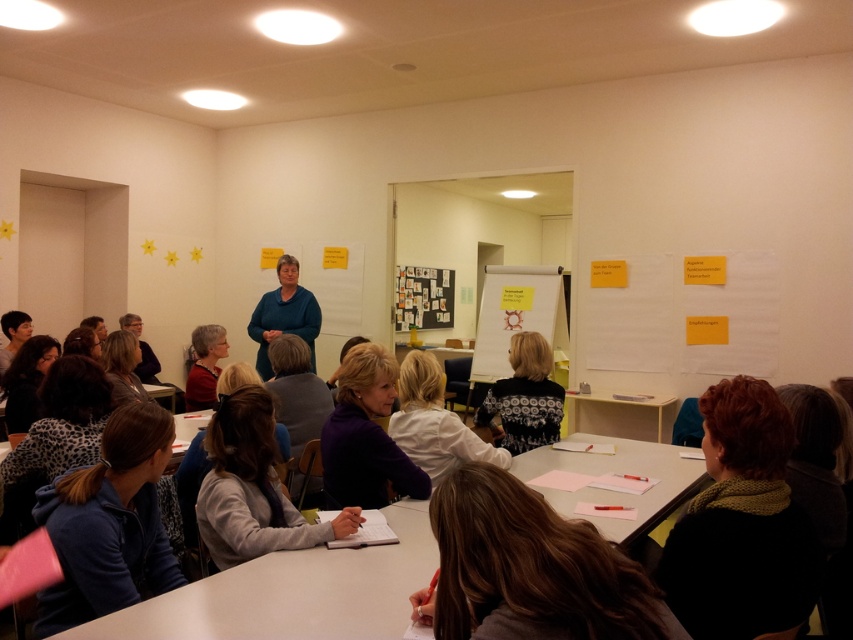
Does point (734, 380) come behind point (204, 531)?

No, it is in front of (204, 531).

Can you confirm if black knit scarf at lower right is smaller than gray fabric jacket at lower center?

Yes.

Where is `black knit scarf at lower right`? The width and height of the screenshot is (853, 640). black knit scarf at lower right is located at coordinates (741, 524).

Where is `black knit scarf at lower right`? Image resolution: width=853 pixels, height=640 pixels. black knit scarf at lower right is located at coordinates (741, 524).

Is the position of dark gray matte bulletin board at center more distant than that of matte black hair at lower left?

Yes.

Does point (398, 296) come farther from viewer compared to point (83, 332)?

Yes, point (398, 296) is behind point (83, 332).

Is point (437, 308) positioned before point (96, 349)?

No, (437, 308) is further to viewer.

Find the location of a particular element. The height and width of the screenshot is (640, 853). dark gray matte bulletin board at center is located at coordinates (422, 298).

Does gray fabric jacket at lower center have a greater width compared to dark gray matte bulletin board at center?

No.

Between gray fabric jacket at lower center and dark gray matte bulletin board at center, which one appears on the left side from the viewer's perspective?

From the viewer's perspective, gray fabric jacket at lower center appears more on the left side.

Does point (242, 428) come in front of point (451, 275)?

Yes.

Locate an element on the screen. The image size is (853, 640). gray fabric jacket at lower center is located at coordinates (252, 486).